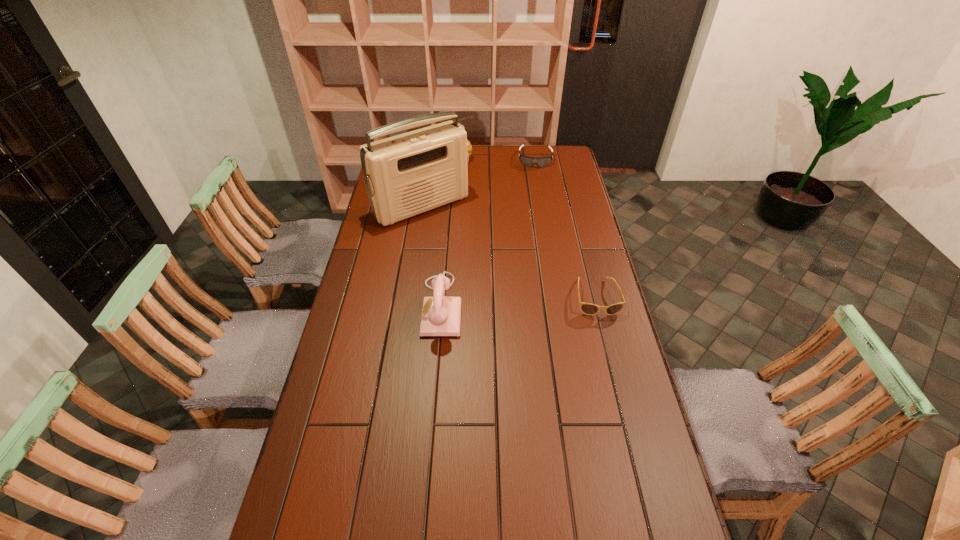
The height and width of the screenshot is (540, 960). I want to click on empty location between the goggles and the third shortest object, so click(497, 158).

Where is `vacant region between the goggles and the radio receiver`? This screenshot has width=960, height=540. vacant region between the goggles and the radio receiver is located at coordinates (479, 183).

You are a GUI agent. You are given a task and a screenshot of the screen. Output one action in this format:
    pyautogui.click(x=<x>, y=<y>)
    Task: Click on the free area in between the goggles and the third shortest object
    
    Given the screenshot: What is the action you would take?
    pyautogui.click(x=497, y=158)

Find the location of a particular element. free space between the telephone and the tallest object is located at coordinates (432, 256).

The image size is (960, 540). Find the location of `vacant point located between the goggles and the sunglasses`. vacant point located between the goggles and the sunglasses is located at coordinates (565, 228).

Find the location of a particular element. empty space between the sunglasses and the goggles is located at coordinates click(565, 228).

This screenshot has width=960, height=540. In order to click on empty space between the sunglasses and the goggles in this screenshot , I will do `click(565, 228)`.

Find the location of a particular element. The image size is (960, 540). blank region between the goggles and the radio receiver is located at coordinates (479, 183).

Identify the location of object that is the second nearest to the goggles. [x=405, y=175].

The width and height of the screenshot is (960, 540). In order to click on the fourth closest object to the third tallest object in this screenshot , I will do `click(587, 308)`.